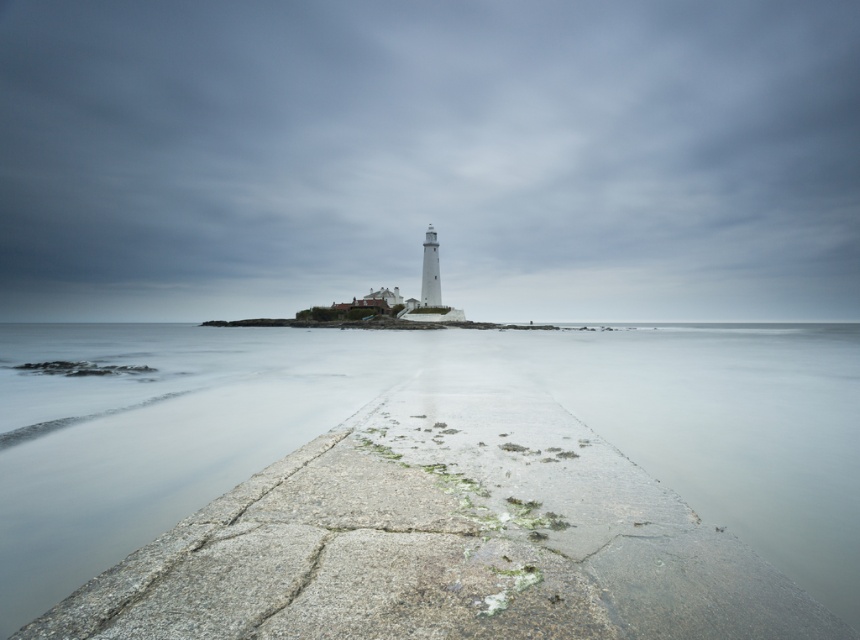
Question: Can you confirm if white concrete lighthouse at center is positioned to the right of clear water at center?

Choices:
 (A) yes
 (B) no

Answer: (A)

Question: Can you confirm if white concrete lighthouse at center is positioned to the right of clear water at center?

Choices:
 (A) yes
 (B) no

Answer: (A)

Question: Is the position of white concrete lighthouse at center more distant than that of clear water at center?

Choices:
 (A) no
 (B) yes

Answer: (B)

Question: Among these points, which one is nearest to the camera?

Choices:
 (A) (97, 92)
 (B) (333, 378)

Answer: (B)

Question: Which point appears closest to the camera in this image?

Choices:
 (A) (508, 464)
 (B) (722, 202)

Answer: (A)

Question: Among these objects, which one is nearest to the camera?

Choices:
 (A) clear water at center
 (B) white concrete lighthouse at center

Answer: (A)